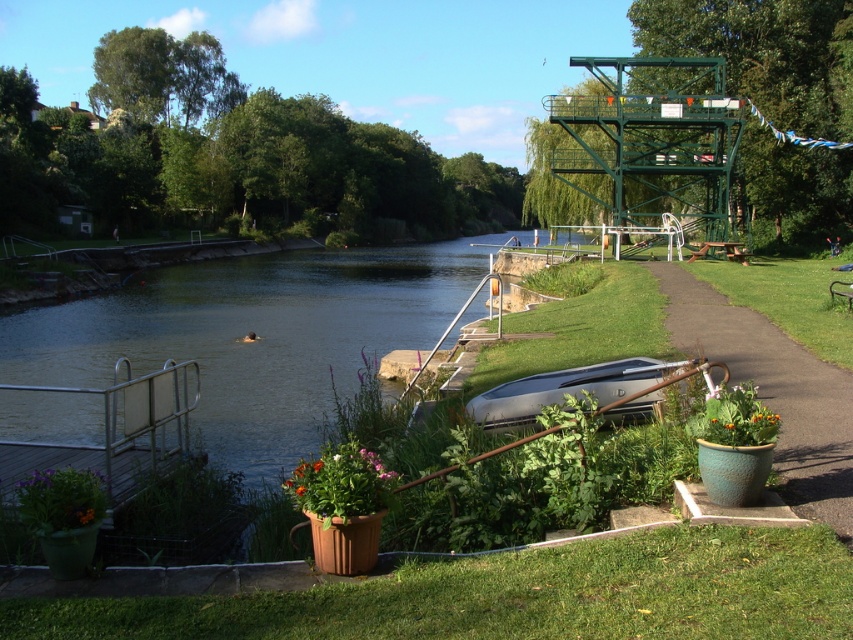
You are a gardener who wants to place a new decorative stone between the matte terracotta pot at lower center and the green ceramic pot at right. According to their positions, which pot should the stone be closer to?

The stone should be placed closer to the matte terracotta pot at lower center because it is positioned on the left side of the green ceramic pot at right.

You are a gardener who wants to place a new plant pot between the green ceramic pot at right and the green leafy plant at center. Based on their sizes, which object should the new pot be placed closer to?

The green ceramic pot at right is wider than the green leafy plant at center, so the new pot should be placed closer to the green leafy plant at center to maintain spacing.

Looking at this image, you are standing at the riverside and want to place a 10 feet long wooden bench between the matte terracotta pot at lower center and the river. Is there enough space?

The matte terracotta pot at lower center is 12.36 feet from the viewer. Since the bench is 10 feet long, there is sufficient space between the pot and the river to accommodate it.